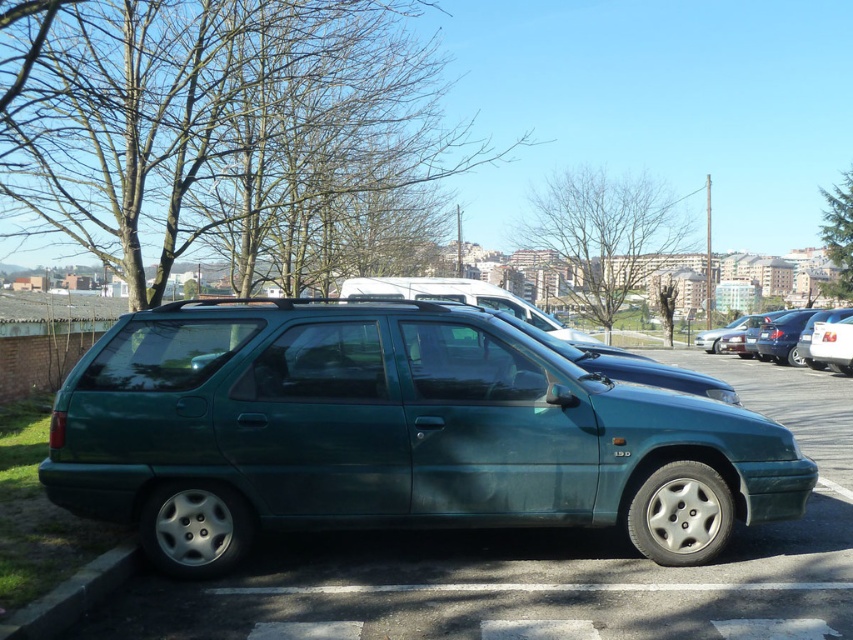
Question: Is green concrete curb at lower left wider than metallic silver sedan at center?

Choices:
 (A) no
 (B) yes

Answer: (A)

Question: Which is nearer to the white glossy van at upper center?

Choices:
 (A) metallic silver sedan at center
 (B) green concrete curb at lower left

Answer: (A)

Question: Is metallic green minivan at center bigger than metallic silver sedan at center?

Choices:
 (A) no
 (B) yes

Answer: (A)

Question: Which point is closer to the camera?

Choices:
 (A) (815, 339)
 (B) (764, 336)
 (C) (532, 376)

Answer: (C)

Question: Which point is farther from the camera taking this photo?

Choices:
 (A) (212, 432)
 (B) (822, 336)

Answer: (B)

Question: Does metallic green minivan at center appear on the right side of white glossy van at upper center?

Choices:
 (A) no
 (B) yes

Answer: (A)